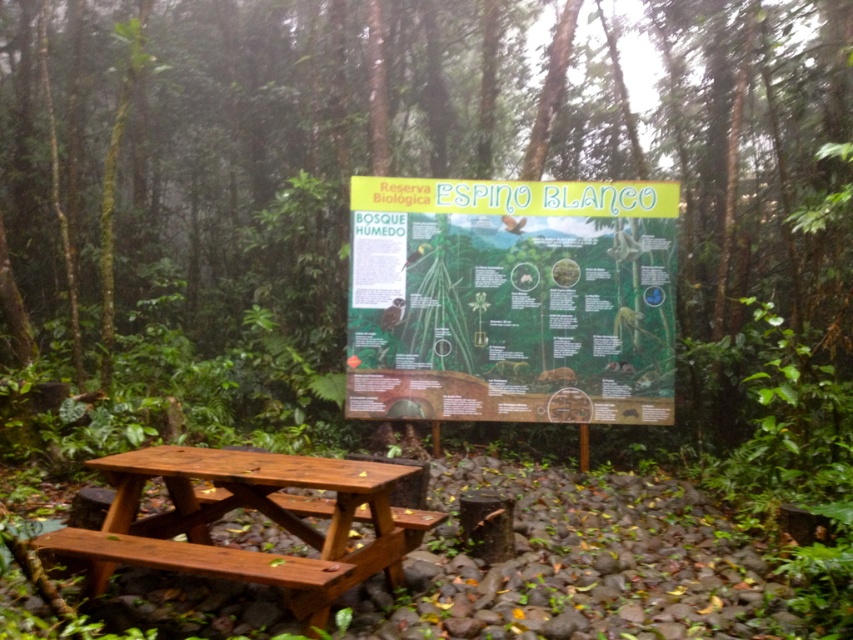
I want to click on matte green board at center, so click(511, 300).

Between matte green board at center and polished wood picnic table at center, which one has less height?

Standing shorter between the two is polished wood picnic table at center.

Is point (376, 291) farther from viewer compared to point (300, 524)?

Yes.

You are a GUI agent. You are given a task and a screenshot of the screen. Output one action in this format:
    pyautogui.click(x=<x>, y=<y>)
    Task: Click on the matte green board at center
    The width and height of the screenshot is (853, 640).
    Given the screenshot: What is the action you would take?
    pyautogui.click(x=511, y=300)

Who is taller, brown wooden sign at center or polished wood picnic table at center?

brown wooden sign at center

Is point (416, 4) positioned after point (212, 499)?

Yes.

Is point (578, 122) positioned in front of point (350, 509)?

No, (578, 122) is further to viewer.

You are a GUI agent. You are given a task and a screenshot of the screen. Output one action in this format:
    pyautogui.click(x=<x>, y=<y>)
    Task: Click on the brown wooden sign at center
    
    Given the screenshot: What is the action you would take?
    pyautogui.click(x=399, y=147)

Is brown wooden sign at center positioned at the back of matte green board at center?

No, brown wooden sign at center is closer to the viewer.

Does brown wooden sign at center have a lesser height compared to matte green board at center?

Incorrect, brown wooden sign at center's height does not fall short of matte green board at center's.

Who is more distant from viewer, (47, 244) or (508, 218)?

The point (47, 244) is more distant.

Find the location of a particular element. The width and height of the screenshot is (853, 640). brown wooden sign at center is located at coordinates (399, 147).